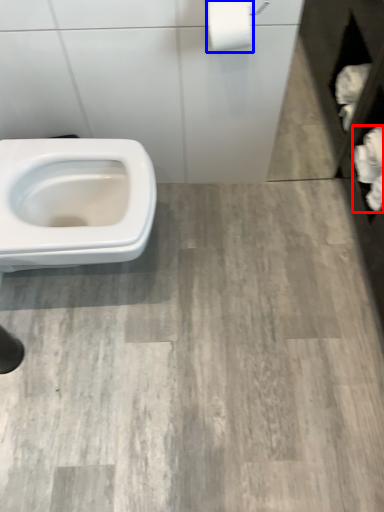
Question: Among these objects, which one is nearest to the camera, toilet paper (highlighted by a red box) or toilet paper (highlighted by a blue box)?

Choices:
 (A) toilet paper
 (B) toilet paper

Answer: (B)